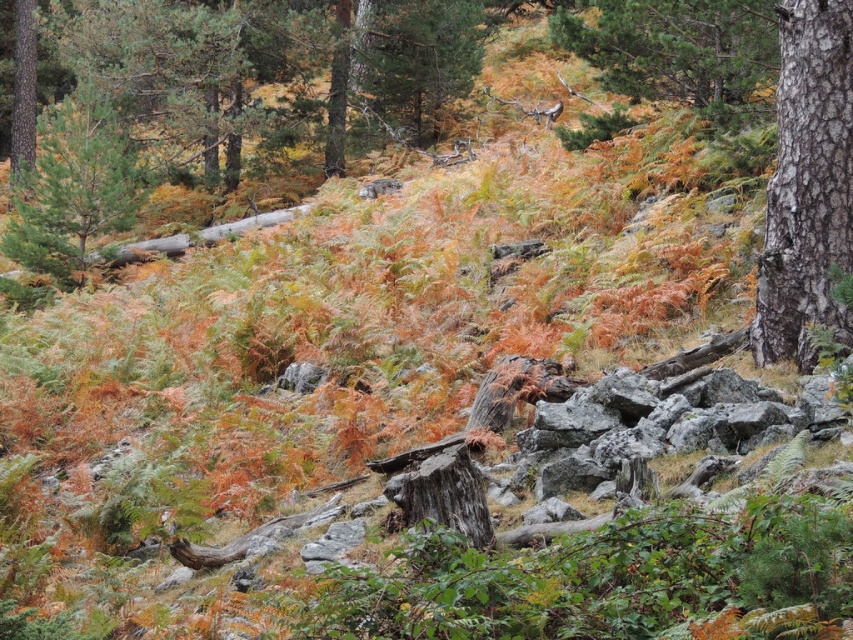
Which is more to the left, smooth bark tree at right or green matte tree at left?

From the viewer's perspective, green matte tree at left appears more on the left side.

Is point (784, 330) positioned after point (112, 179)?

No, (784, 330) is closer to viewer.

This screenshot has width=853, height=640. What are the coordinates of `smooth bark tree at right` in the screenshot? It's located at (807, 184).

Can you confirm if brown rough tree trunk at upper center is smaller than green matte tree at left?

Yes, brown rough tree trunk at upper center is smaller than green matte tree at left.

Is brown rough tree trunk at upper center shorter than green matte tree at left?

Correct, brown rough tree trunk at upper center is not as tall as green matte tree at left.

At what (x,y) coordinates should I click in order to perform the action: click on brown rough tree trunk at upper center. Please return your answer as a coordinate pair (x, y). This screenshot has height=640, width=853. Looking at the image, I should click on (680, 52).

Where is `brown rough tree trunk at upper center`? This screenshot has width=853, height=640. brown rough tree trunk at upper center is located at coordinates (680, 52).

Can you confirm if green matte tree at left is positioned to the right of smooth brown tree trunk at left?

Indeed, green matte tree at left is positioned on the right side of smooth brown tree trunk at left.

Is green matte tree at left further to the viewer compared to smooth brown tree trunk at left?

No, it is in front of smooth brown tree trunk at left.

Between point (42, 166) and point (24, 120), which one is positioned behind?

Point (24, 120)

Identify the location of green matte tree at left. (74, 186).